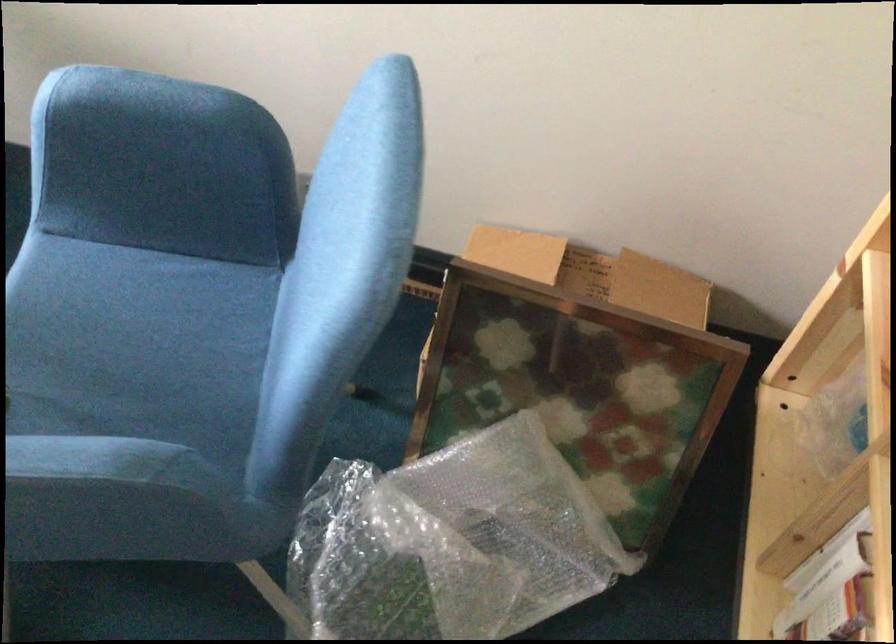
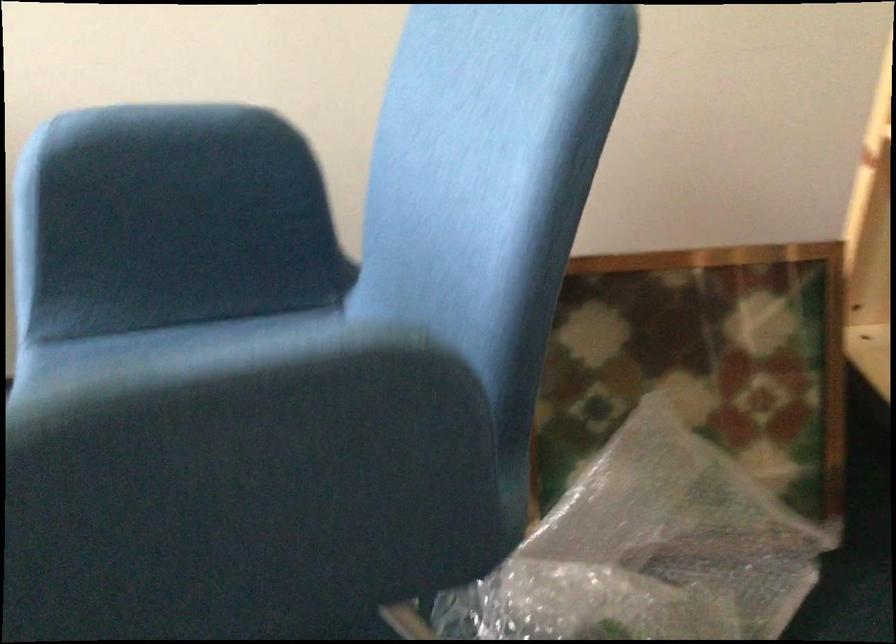
In the second image, find the point that corresponds to point 588,399 in the first image.

(702, 363)